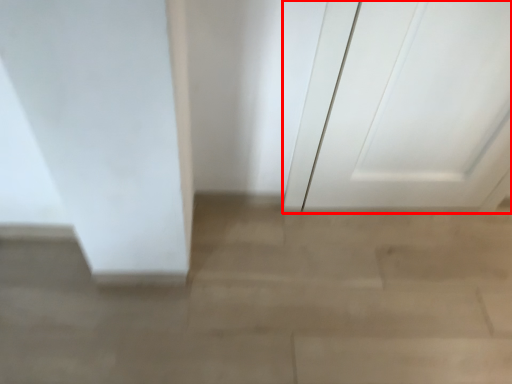
Question: From the image's perspective, where is door (annotated by the red box) located relative to concrete?

Choices:
 (A) below
 (B) above

Answer: (B)